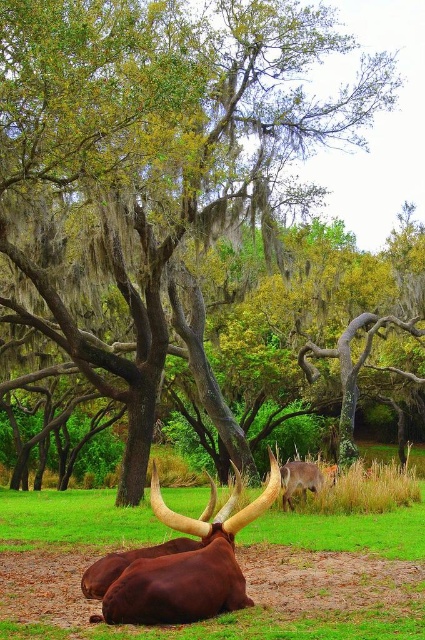
Question: From the image, what is the correct spatial relationship of brown glossy horned bull at lower center in relation to shiny brown deer at center?

Choices:
 (A) above
 (B) below

Answer: (A)

Question: Is brown glossy horned bull at lower center closer to camera compared to shiny brown deer at center?

Choices:
 (A) no
 (B) yes

Answer: (B)

Question: Which of the following is the farthest from the observer?

Choices:
 (A) (263, 497)
 (B) (300, 476)

Answer: (B)

Question: Considering the relative positions of brown glossy horned bull at lower center and shiny brown deer at center in the image provided, where is brown glossy horned bull at lower center located with respect to shiny brown deer at center?

Choices:
 (A) left
 (B) right

Answer: (A)

Question: Which of the following is the closest to the observer?

Choices:
 (A) shiny brown deer at center
 (B) brown glossy horned bull at lower center

Answer: (B)

Question: Among these objects, which one is farthest from the camera?

Choices:
 (A) brown glossy horned bull at lower center
 (B) shiny brown deer at center

Answer: (B)